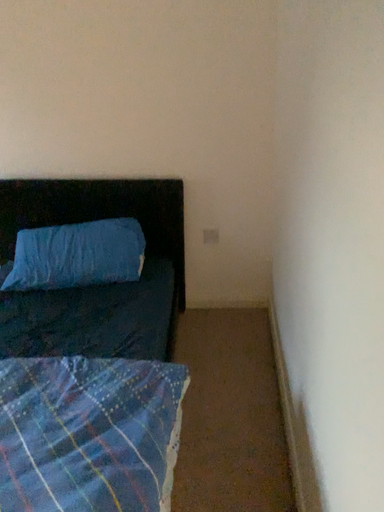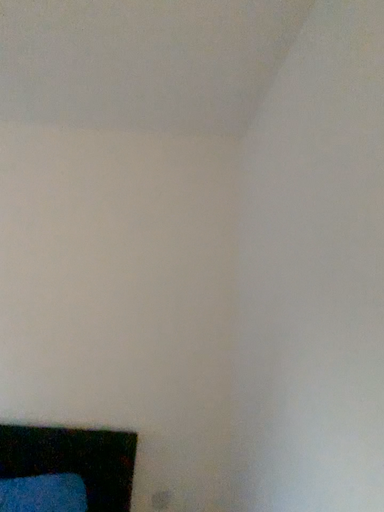
Question: Which way did the camera rotate in the video?

Choices:
 (A) rotated downward
 (B) rotated upward

Answer: (B)